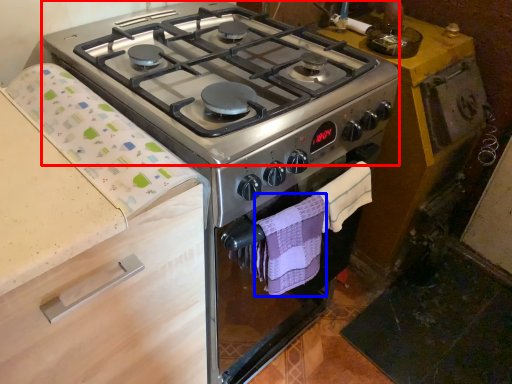
Question: Among these objects, which one is nearest to the camera, gas stove (highlighted by a red box) or hand towel (highlighted by a blue box)?

Choices:
 (A) gas stove
 (B) hand towel

Answer: (A)